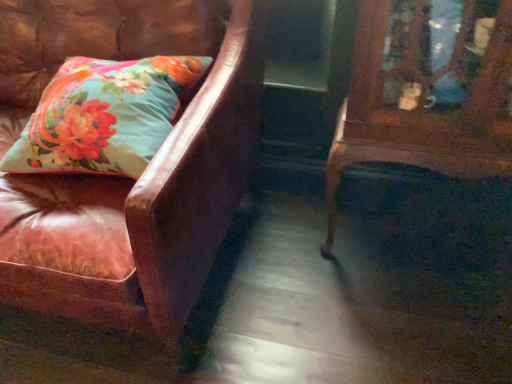
The image size is (512, 384). I want to click on free region under mahogany wood side table at right (from a real-world perspective), so click(418, 247).